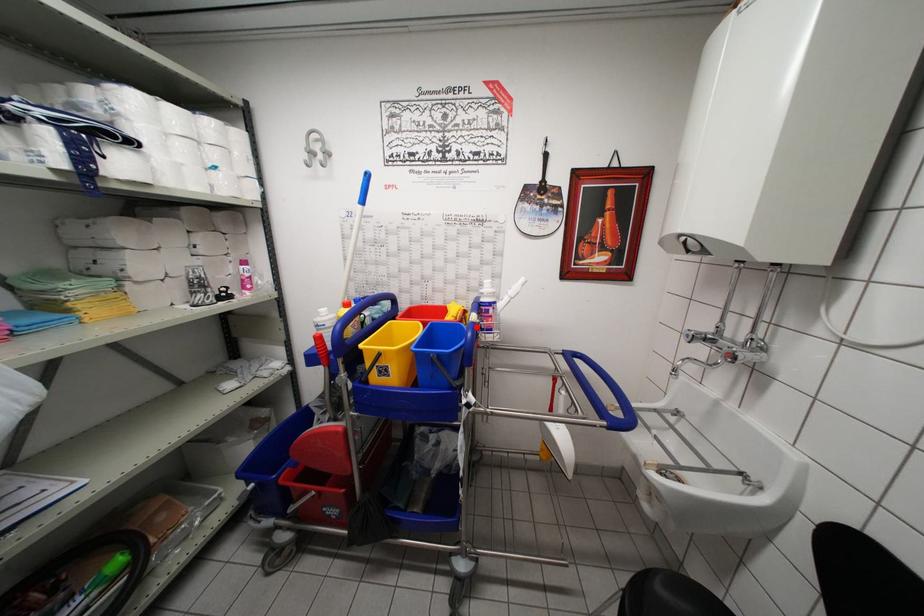
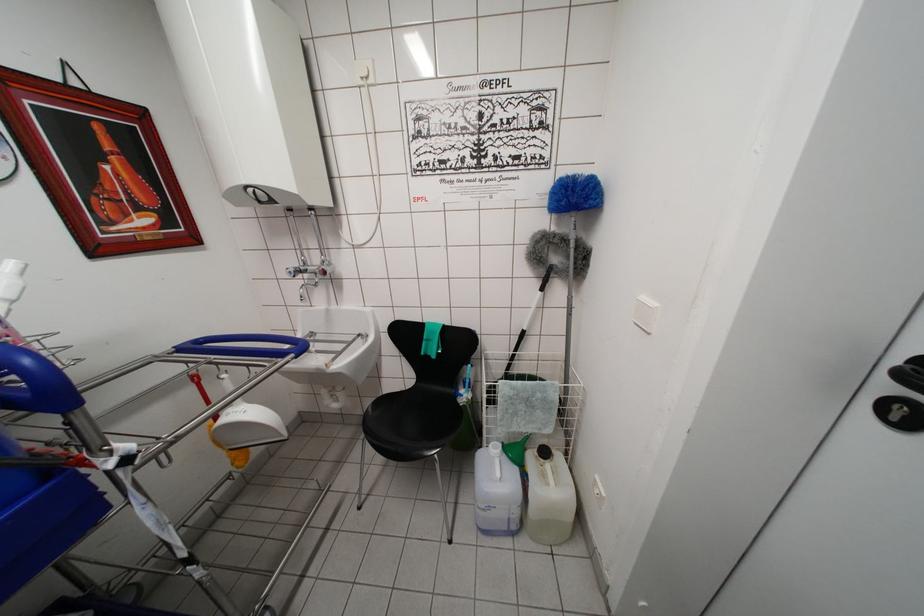
Where in the second image is the point corresponding to the highlighted location from the first image?

(5, 349)